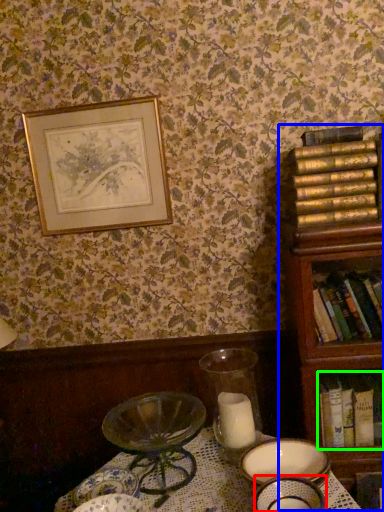
Question: Which is farther away from tableware (highlighted by a red box)? bookcase (highlighted by a blue box) or book (highlighted by a green box)?

Choices:
 (A) bookcase
 (B) book

Answer: (A)